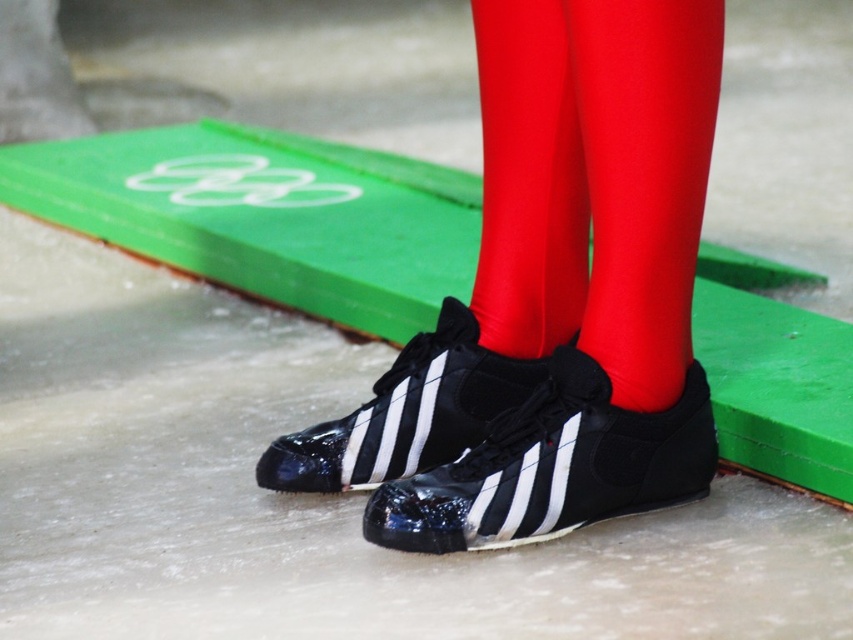
Is shiny red tights at center taller than black rubber shoe at center?

Yes.

Where is `shiny red tights at center`? shiny red tights at center is located at coordinates (595, 180).

Between point (660, 99) and point (375, 392), which one is positioned in front?

Point (660, 99)

This screenshot has width=853, height=640. Find the location of `shiny red tights at center`. shiny red tights at center is located at coordinates (595, 180).

Between shiny black sneakers at center and black rubber shoe at center, which one is positioned higher?

shiny black sneakers at center is higher up.

Can you confirm if shiny black sneakers at center is wider than black rubber shoe at center?

Yes.

Who is more forward, (448,508) or (343,452)?

Point (448,508) is more forward.

Where is `shiny black sneakers at center`? This screenshot has height=640, width=853. shiny black sneakers at center is located at coordinates (553, 296).

Is point (642, 36) more distant than point (601, 404)?

No, it is in front of (601, 404).

Describe the element at coordinates (553, 296) in the screenshot. The height and width of the screenshot is (640, 853). I see `shiny black sneakers at center` at that location.

Find the location of a particular element. shiny black sneakers at center is located at coordinates (553, 296).